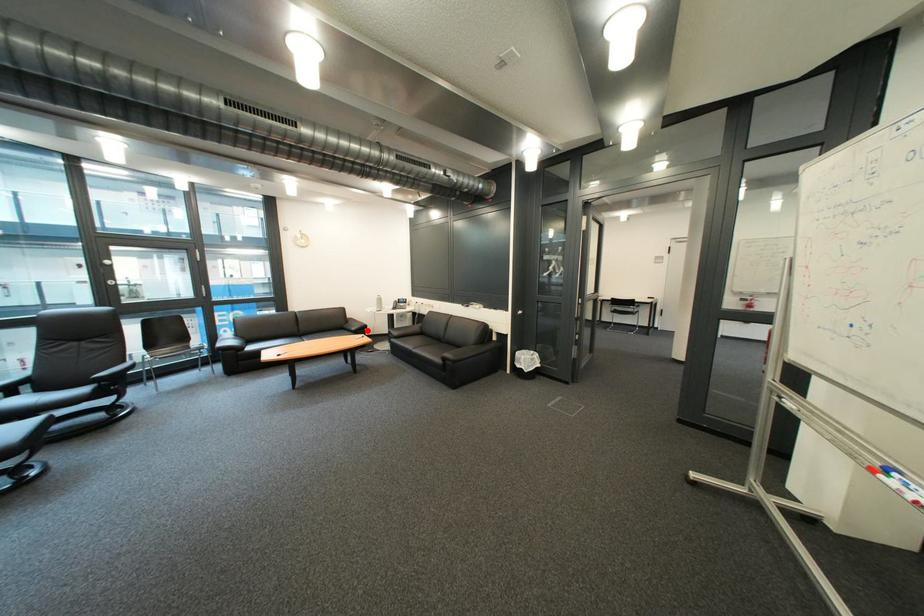
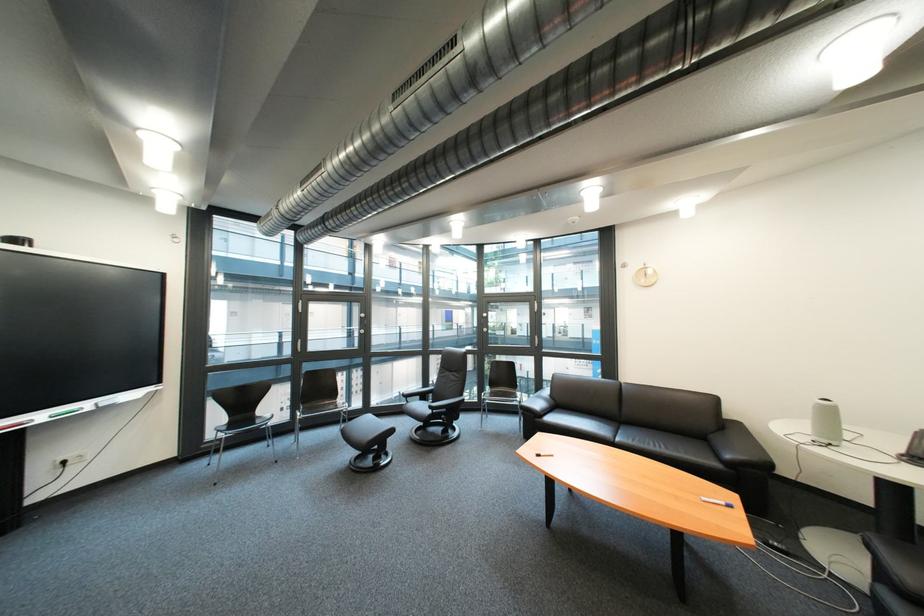
Question: I am providing you with two images of the same scene from different viewpoints. A red point is marked on the first image. Is the red point's position out of view in image 2?

Choices:
 (A) Yes
 (B) No

Answer: (B)